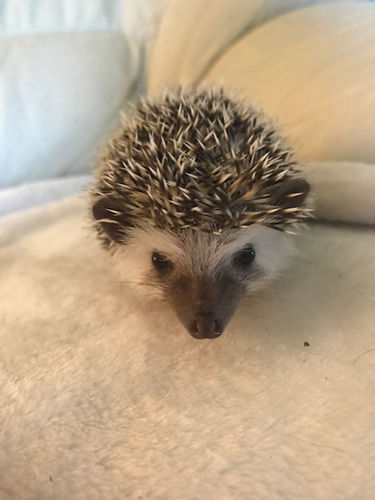
At what (x,y) coordinates should I click in order to perform the action: click on couch. Please return your answer as a coordinate pair (x, y). This screenshot has height=500, width=375. Looking at the image, I should click on (254, 432).